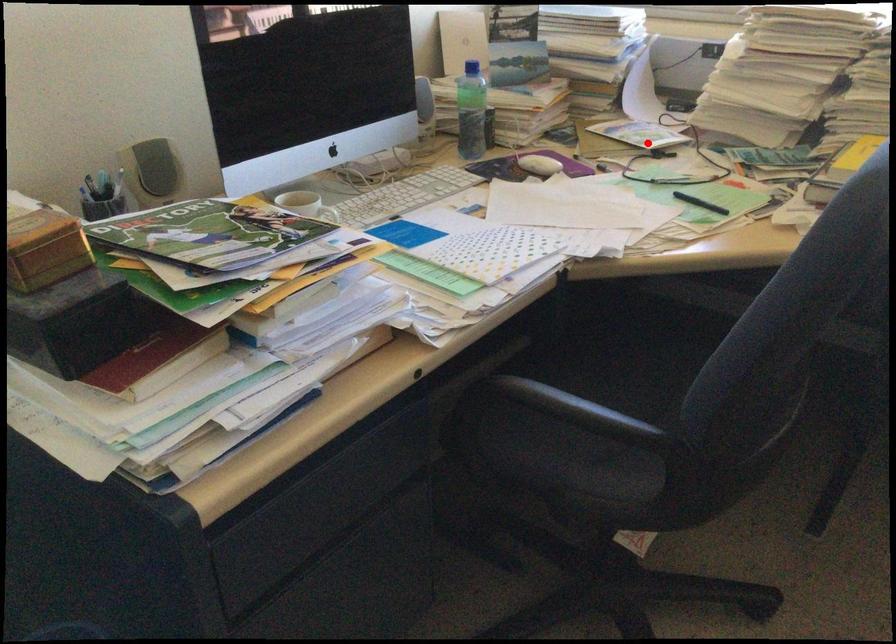
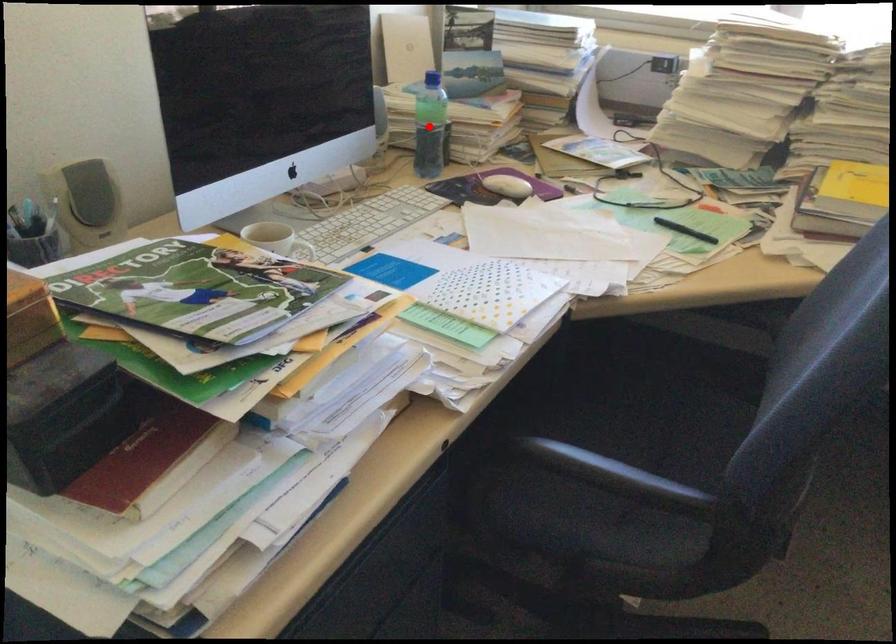
I am providing you with two images of the same scene from different viewpoints. A red point is marked on the first image and another point is marked on the second image. Does the point marked in image1 correspond to the same location as the one in image2?

No